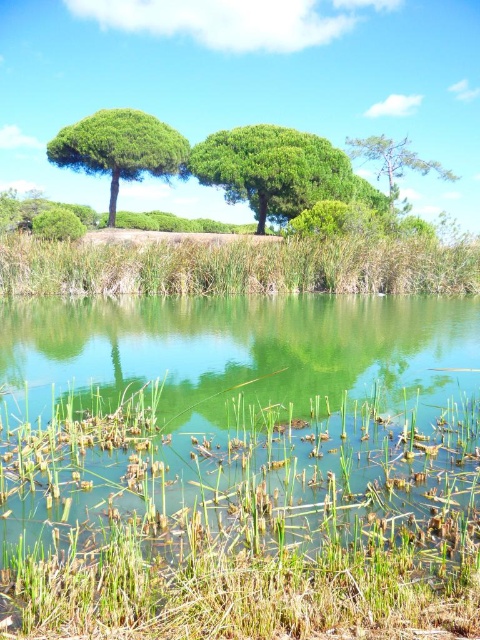
What do you see at coordinates (272, 170) in the screenshot? This screenshot has height=640, width=480. I see `green leafy tree at center` at bounding box center [272, 170].

Between green leafy tree at center and green matte tree at upper left, which one has more height?

green matte tree at upper left is taller.

In order to click on green leafy tree at center in this screenshot , I will do `click(272, 170)`.

Does green grassy lake at bottom come in front of green leafy tree at center?

Answer: That is True.

Does green grassy lake at bottom appear under green leafy tree at center?

Indeed, green grassy lake at bottom is positioned under green leafy tree at center.

Which is in front, point (186, 397) or point (308, 202)?

Positioned in front is point (186, 397).

Identify the location of green grassy lake at bottom. (235, 413).

How much distance is there between green grassy lake at bottom and green grassy reed at lower center?

The distance of green grassy lake at bottom from green grassy reed at lower center is 12.24 meters.

Is green grassy lake at bottom taller than green grassy reed at lower center?

No, green grassy lake at bottom is not taller than green grassy reed at lower center.

Where is `green grassy lake at bottom`? Image resolution: width=480 pixels, height=640 pixels. green grassy lake at bottom is located at coordinates (235, 413).